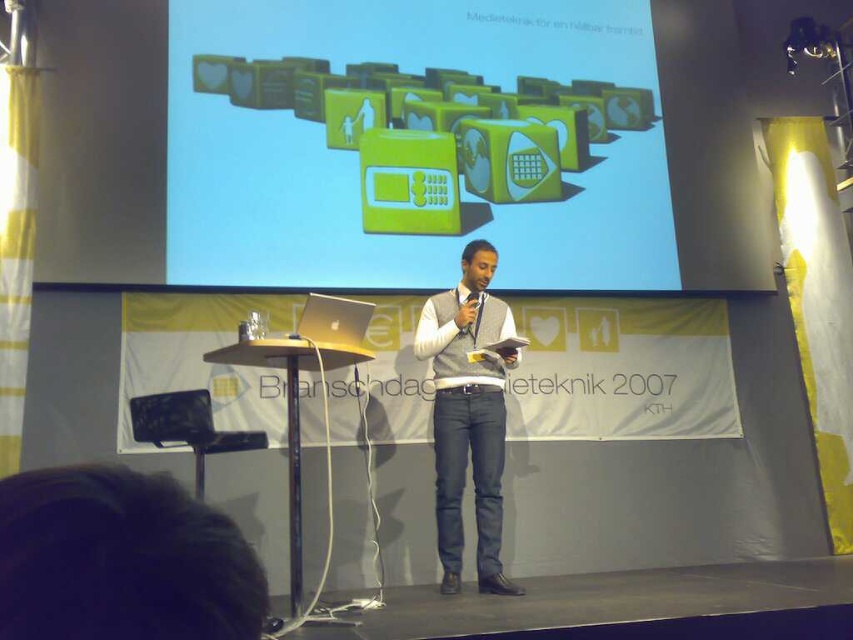
Question: Which object appears farthest from the camera in this image?

Choices:
 (A) gray sweater vest at center
 (B) green glossy microwave at upper center
 (C) black plastic microphone at center

Answer: (B)

Question: Which object is positioned closest to the black plastic microphone at center?

Choices:
 (A) gray sweater vest at center
 (B) green glossy microwave at upper center

Answer: (A)

Question: Can you confirm if gray sweater vest at center is positioned below black plastic microphone at center?

Choices:
 (A) no
 (B) yes

Answer: (B)

Question: Based on their relative distances, which object is farther from the black plastic microphone at center?

Choices:
 (A) green glossy microwave at upper center
 (B) gray sweater vest at center

Answer: (A)

Question: Where is green glossy microwave at upper center located in relation to black plastic microphone at center in the image?

Choices:
 (A) above
 (B) below

Answer: (A)

Question: Does green glossy microwave at upper center have a greater width compared to black plastic microphone at center?

Choices:
 (A) no
 (B) yes

Answer: (B)